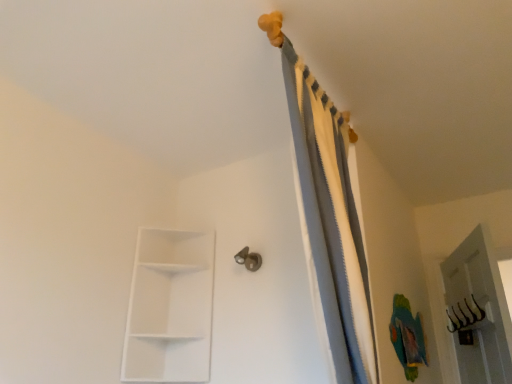
Question: Does white matte/shelf at lower left appear on the right side of metallic silver door handle at center?

Choices:
 (A) yes
 (B) no

Answer: (B)

Question: Can you confirm if white matte/shelf at lower left is taller than metallic silver door handle at center?

Choices:
 (A) yes
 (B) no

Answer: (A)

Question: Does white matte/shelf at lower left come in front of metallic silver door handle at center?

Choices:
 (A) yes
 (B) no

Answer: (A)

Question: Is white matte/shelf at lower left not within metallic silver door handle at center?

Choices:
 (A) no
 (B) yes

Answer: (B)

Question: Is white matte/shelf at lower left positioned with its back to metallic silver door handle at center?

Choices:
 (A) no
 (B) yes

Answer: (A)

Question: Does white matte/shelf at lower left have a larger size compared to metallic silver door handle at center?

Choices:
 (A) no
 (B) yes

Answer: (B)

Question: From a real-world perspective, is gray fabric curtain at upper center over white matte/shelf at lower left?

Choices:
 (A) no
 (B) yes

Answer: (B)

Question: Is gray fabric curtain at upper center facing towards white matte/shelf at lower left?

Choices:
 (A) no
 (B) yes

Answer: (A)

Question: From the image's perspective, is gray fabric curtain at upper center on white matte/shelf at lower left?

Choices:
 (A) yes
 (B) no

Answer: (A)

Question: Considering the relative positions of gray fabric curtain at upper center and white matte/shelf at lower left in the image provided, is gray fabric curtain at upper center to the right of white matte/shelf at lower left from the viewer's perspective?

Choices:
 (A) no
 (B) yes

Answer: (B)

Question: Does gray fabric curtain at upper center have a lesser width compared to white matte/shelf at lower left?

Choices:
 (A) no
 (B) yes

Answer: (B)

Question: Are gray fabric curtain at upper center and white matte/shelf at lower left beside each other?

Choices:
 (A) yes
 (B) no

Answer: (B)

Question: Is white matte/shelf at lower left shorter than gray fabric curtain at upper center?

Choices:
 (A) yes
 (B) no

Answer: (A)